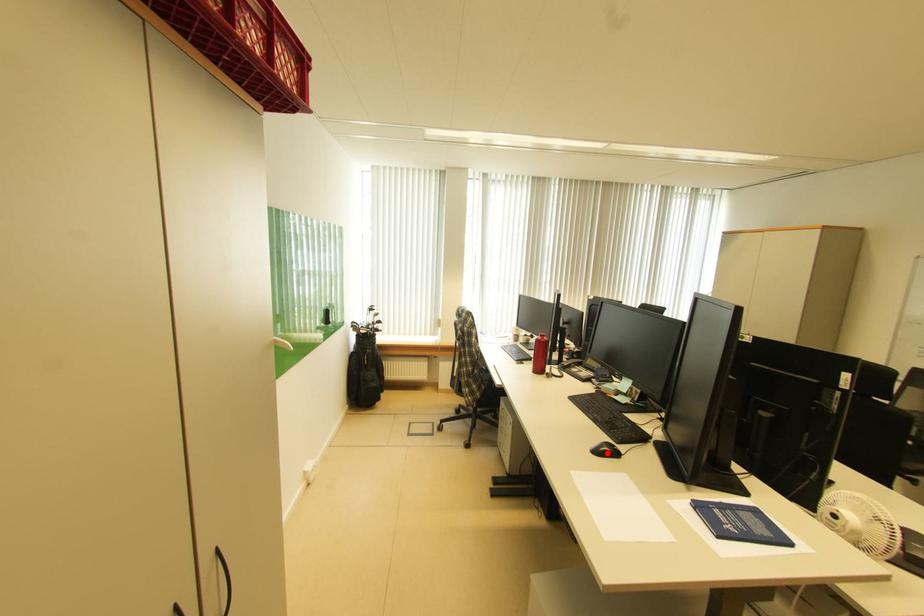
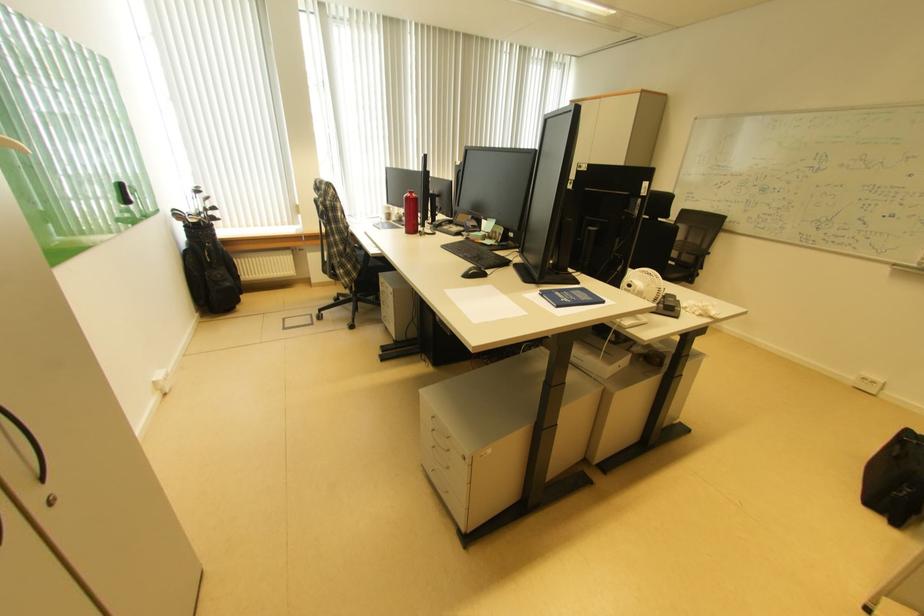
Where in the second image is the point corresponding to the highlighted location from the first image?

(477, 277)